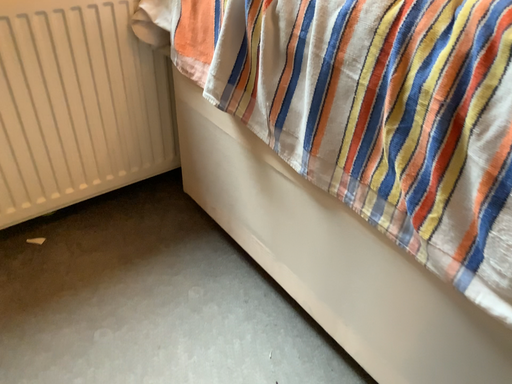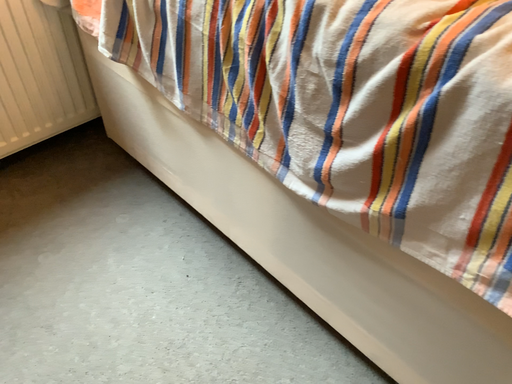
Question: How did the camera likely rotate when shooting the video?

Choices:
 (A) rotated downward
 (B) rotated upward

Answer: (A)